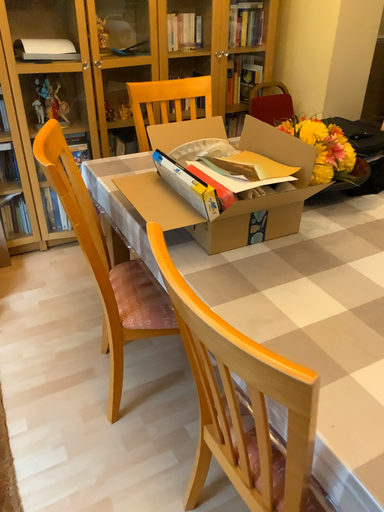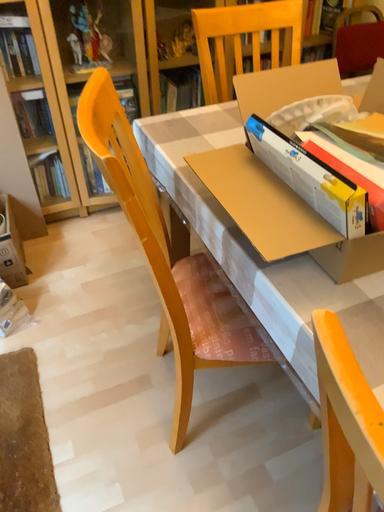
Question: How did the camera likely rotate when shooting the video?

Choices:
 (A) rotated downward
 (B) rotated upward

Answer: (A)